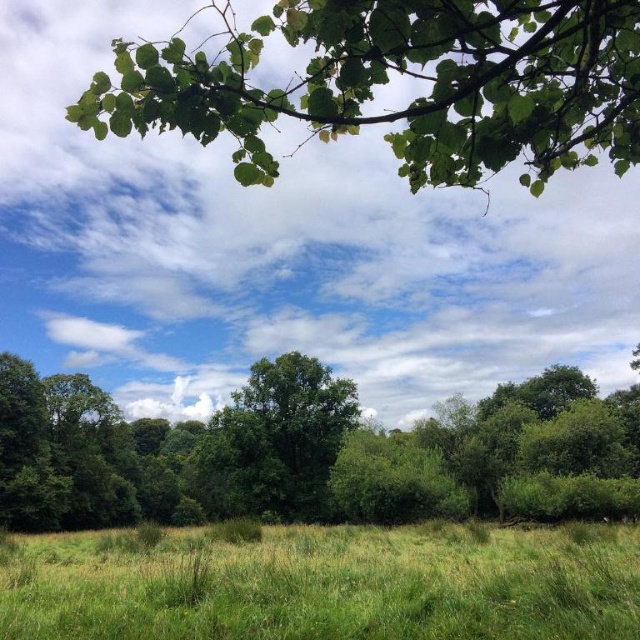
You are standing in the middle of the green leafy forest at center and want to look up at the green leafy branch at upper center. Since the forest is shorter than the branch, will you be able to see the branch clearly without any obstruction?

The green leafy forest at center is shorter than the green leafy branch at upper center, so you can see the branch clearly without obstruction.

You are standing in the middle of the green field and see the point marked at coordinates (314, 452). What is located at that point?

The green leafy forest at center is located at point (314, 452).